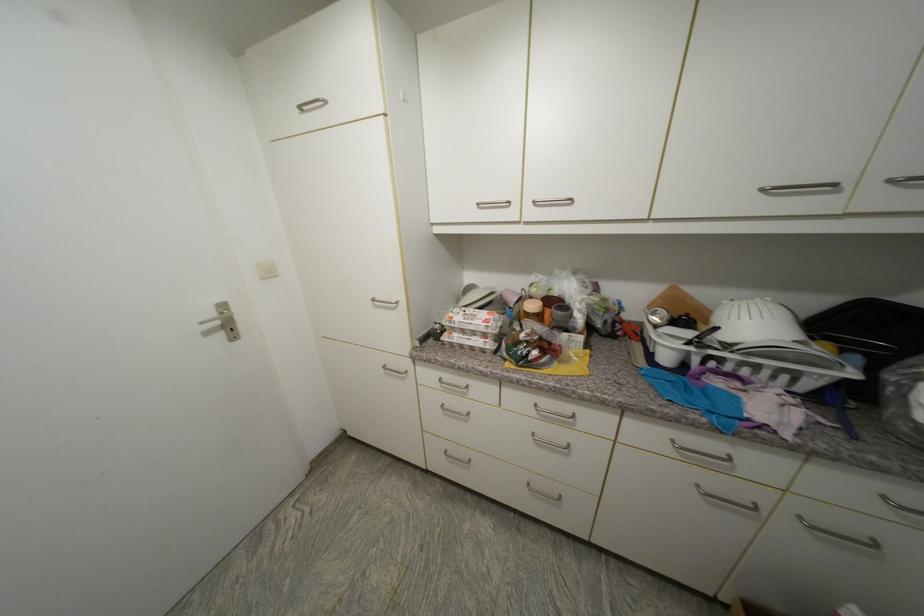
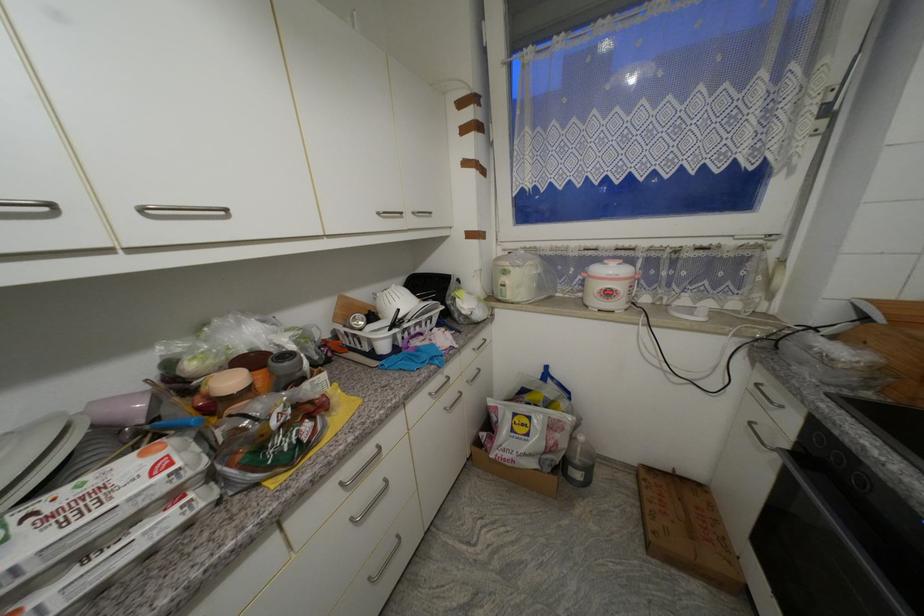
Find the pixel in the second image that matches pixel 493 315 in the first image.

(149, 456)